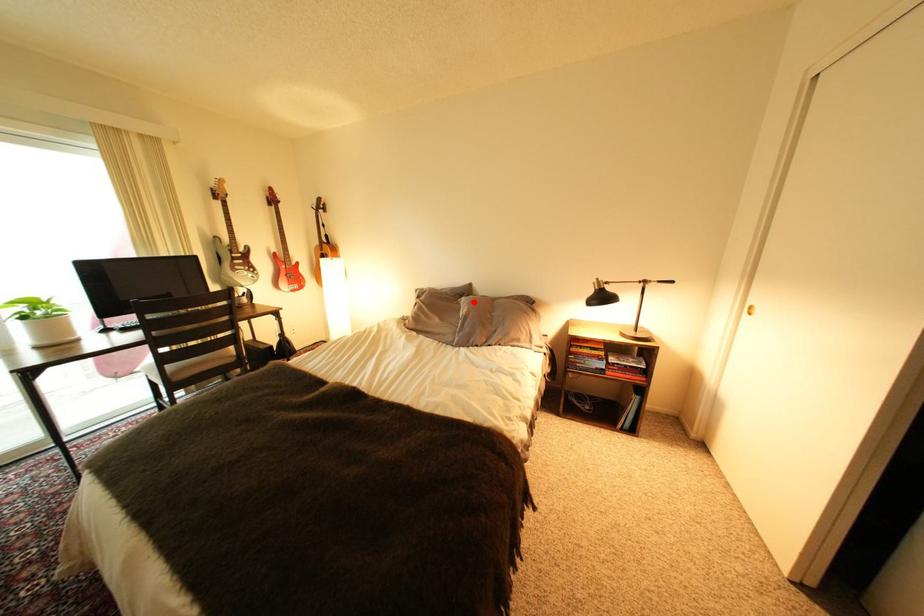
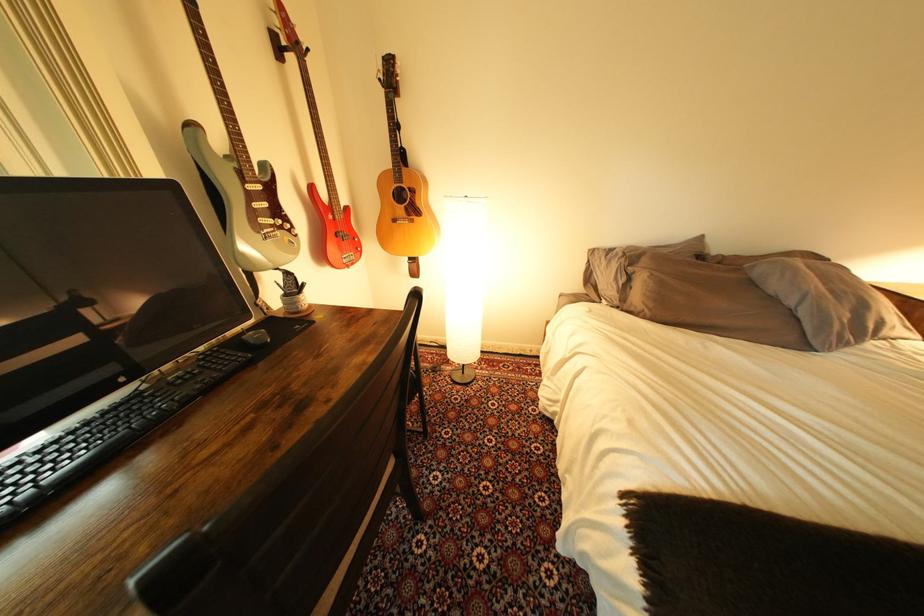
Find the pixel in the second image that matches the highlighted location in the first image.

(767, 268)